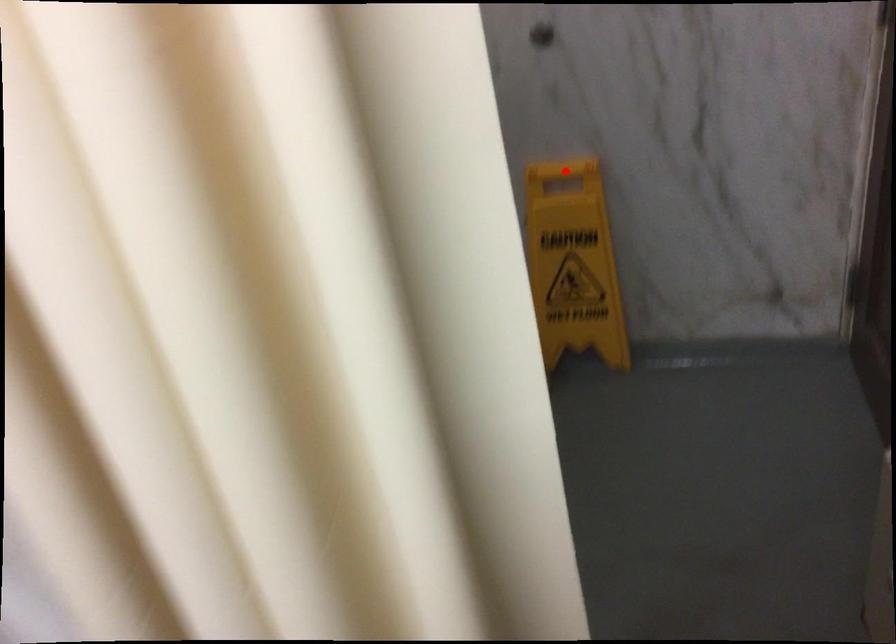
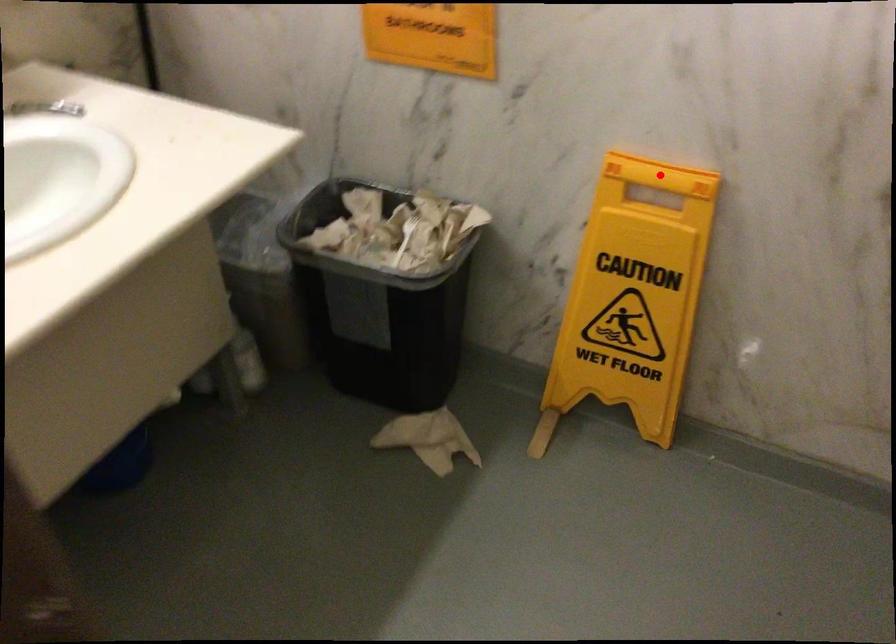
I am providing you with two images of the same scene from different viewpoints. A red point is marked on the first image and another point is marked on the second image. Is the marked point in image1 the same physical position as the marked point in image2?

Yes